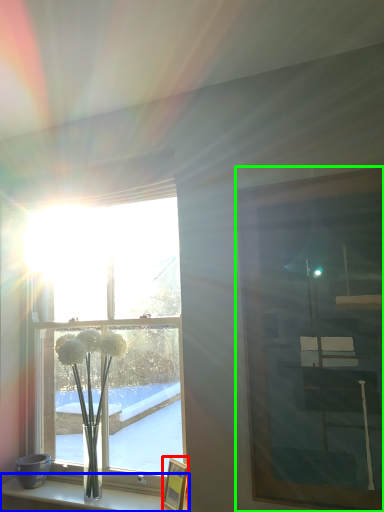
Question: Which is nearer to the picture frame (highlighted by a red box)? shelf (highlighted by a blue box) or picture frame (highlighted by a green box).

Choices:
 (A) shelf
 (B) picture frame

Answer: (A)